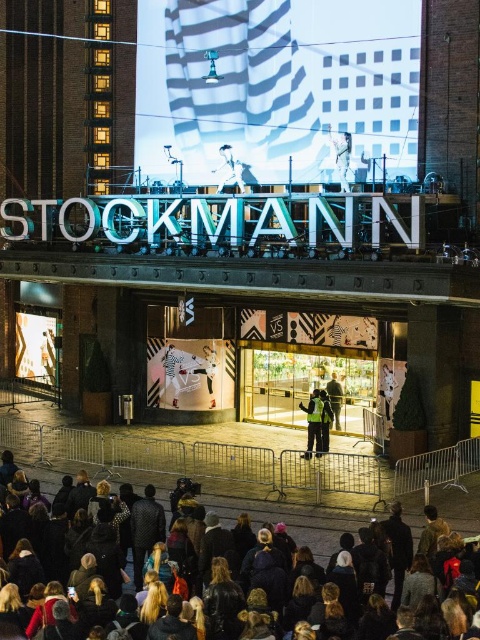
You are a photographer positioned at the front of the scene. You want to capture both the reflective yellow vest at center and the dark gray jacket at center in a single photo. Which object should you focus on first to ensure both are in clear view?

You should focus on the reflective yellow vest at center first since it is closer to you than the dark gray jacket at center, ensuring both will be in focus when using depth of field techniques.

You are a photographer standing at the back of the crowd in the image. You want to take a photo of the STOCKMANN sign but there are two people in front of you wearing a reflective yellow vest at center and a dark gray jacket at center. Which person might you ask to move so you can see the sign better?

The reflective yellow vest at center is shorter than the dark gray jacket at center, so you should ask the reflective yellow vest at center to move because they are shorter and blocking less of your view.